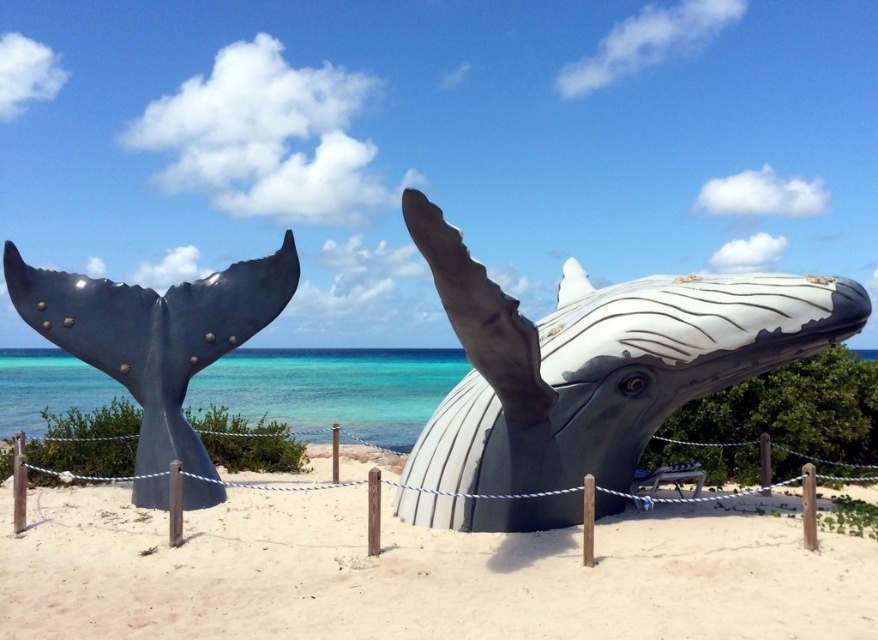
Question: Which of these objects is positioned closest to the clear blue water at whale right?

Choices:
 (A) metallic gray whale at center
 (B) metallic gray whale tail at left
 (C) gray matte whale head at center

Answer: (B)

Question: Is gray matte whale head at center positioned at the back of clear blue water at whale right?

Choices:
 (A) yes
 (B) no

Answer: (B)

Question: Does metallic gray whale at center come in front of clear blue water at whale right?

Choices:
 (A) no
 (B) yes

Answer: (B)

Question: Considering the real-world distances, which object is farthest from the metallic gray whale at center?

Choices:
 (A) metallic gray whale tail at left
 (B) gray matte whale head at center

Answer: (A)

Question: Among these points, which one is farthest from the camera?

Choices:
 (A) (167, 301)
 (B) (788, 602)
 (C) (349, 413)

Answer: (C)

Question: Can you confirm if metallic gray whale at center is bigger than clear blue water at whale right?

Choices:
 (A) no
 (B) yes

Answer: (A)